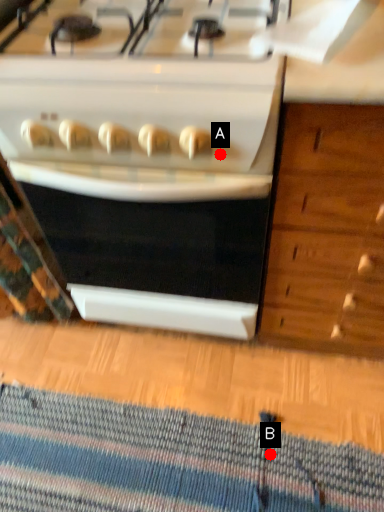
Question: Two points are circled on the image, labeled by A and B beside each circle. Which point is closer to the camera?

Choices:
 (A) A is closer
 (B) B is closer

Answer: (A)